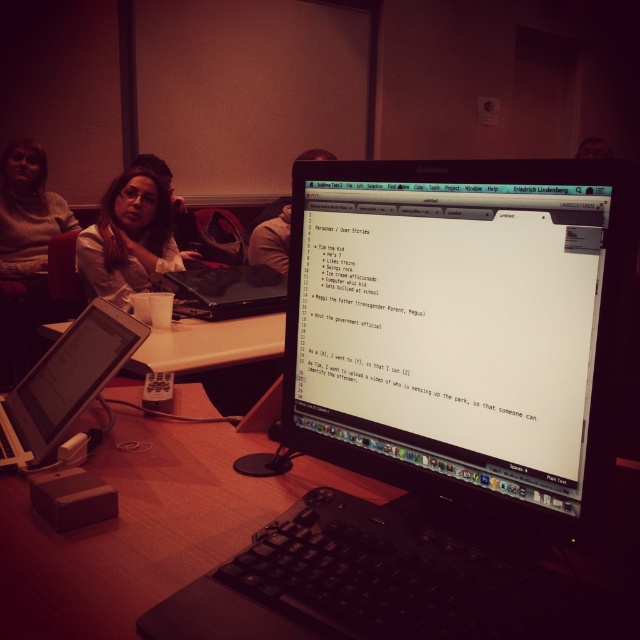
Question: Can you confirm if white plastic table at center is positioned below black matte laptop at center?

Choices:
 (A) no
 (B) yes

Answer: (B)

Question: Does matte beige sweater at upper left appear on the right side of black matte laptop at center?

Choices:
 (A) no
 (B) yes

Answer: (A)

Question: Which point is closer to the camera?

Choices:
 (A) silver metallic laptop at lower left
 (B) black glossy monitor at center
 (C) black matte laptop at center
 (D) white plastic table at center

Answer: (B)

Question: Is silver metallic laptop at lower left thinner than matte white shirt at upper left?

Choices:
 (A) no
 (B) yes

Answer: (B)

Question: Which is farther from the black glossy monitor at center?

Choices:
 (A) matte beige sweater at upper left
 (B) wooden table at center

Answer: (A)

Question: Among these objects, which one is farthest from the camera?

Choices:
 (A) matte white shirt at upper left
 (B) black glossy monitor at center

Answer: (A)